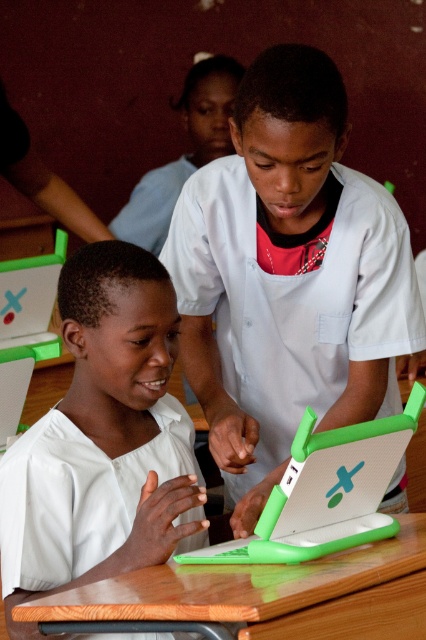
Is white matte shirt at center taller than green plastic laptop at center?

Yes.

Who is lower down, white matte shirt at center or green plastic laptop at center?

Positioned lower is green plastic laptop at center.

Locate an element on the screen. white matte shirt at center is located at coordinates (103, 440).

What are the coordinates of `white matte shirt at center` in the screenshot? It's located at (103, 440).

Does point (58, 282) come behind point (132, 227)?

No, it is in front of (132, 227).

The height and width of the screenshot is (640, 426). What are the coordinates of `white matte shirt at center` in the screenshot? It's located at (103, 440).

Which of these two, white matte shirt at center or green wood table at center, stands shorter?

Standing shorter between the two is green wood table at center.

Is white matte shirt at center shorter than green wood table at center?

No, white matte shirt at center is not shorter than green wood table at center.

Which is in front, point (55, 548) or point (397, 620)?

Point (397, 620) is more forward.

Locate an element on the screen. Image resolution: width=426 pixels, height=640 pixels. white matte shirt at center is located at coordinates (103, 440).